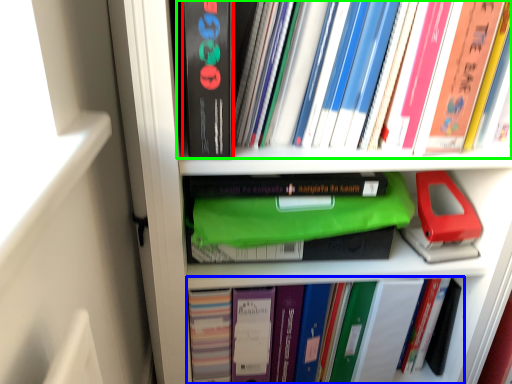
Question: Which object is positioned closest to paperback book (highlighted by a red box)? Select from book (highlighted by a blue box) and book (highlighted by a green box).

Choices:
 (A) book
 (B) book

Answer: (B)